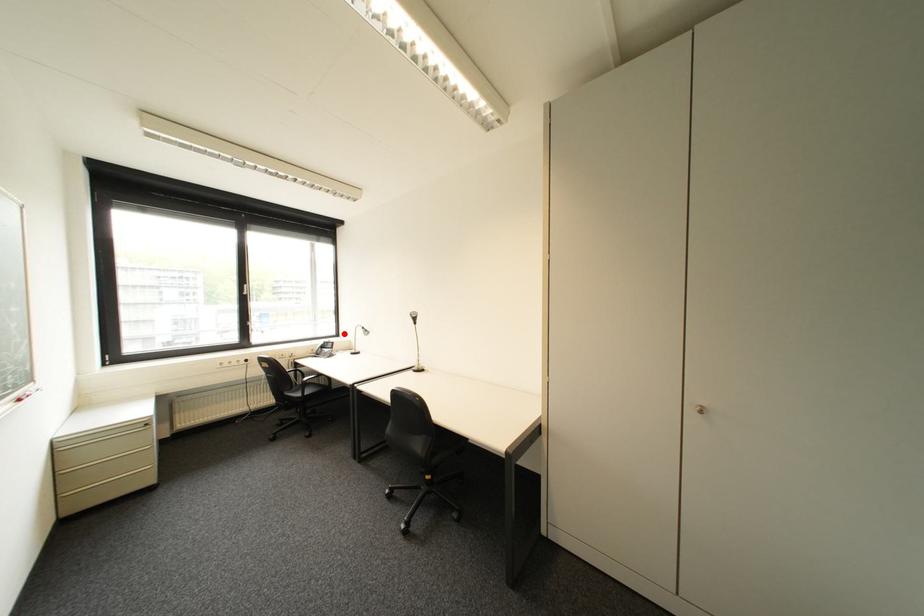
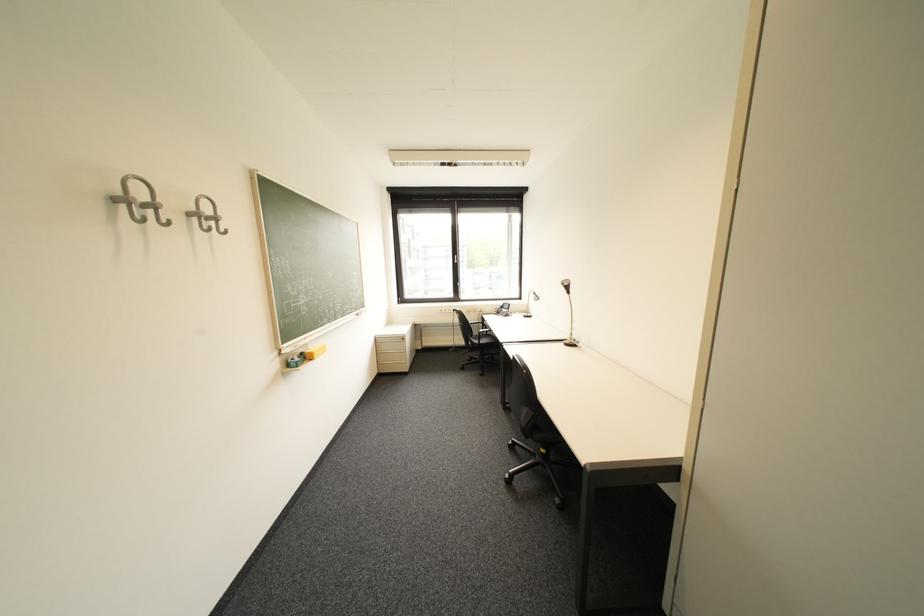
Question: I am providing you with two images of the same scene from different viewpoints. Given a red point in image1, look at the same physical point in image2. Is it:

Choices:
 (A) Closer to the viewpoint
 (B) Farther from the viewpoint

Answer: (A)